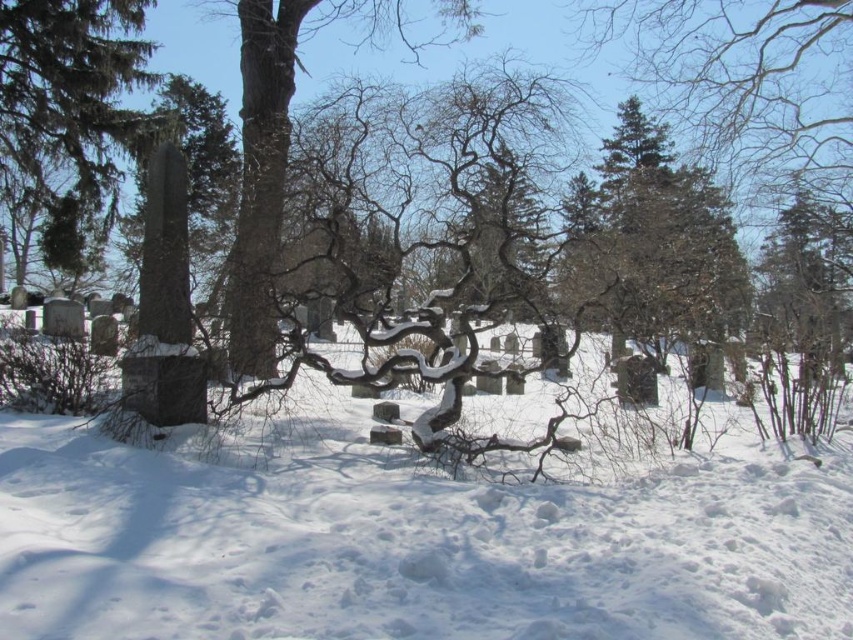
Question: Which of the following is the farthest from the observer?

Choices:
 (A) white powdery snow at center
 (B) smooth gray stone at left
 (C) smooth gray stone at center

Answer: (B)

Question: Is smooth gray stone at left closer to camera compared to smooth gray stone at center?

Choices:
 (A) no
 (B) yes

Answer: (A)

Question: Among these points, which one is nearest to the camera?

Choices:
 (A) (55, 90)
 (B) (579, 454)

Answer: (B)

Question: Which point appears closest to the camera in this image?

Choices:
 (A) (86, 115)
 (B) (271, 596)

Answer: (B)

Question: Can you confirm if white powdery snow at center is positioned below smooth gray stone at center?

Choices:
 (A) yes
 (B) no

Answer: (A)

Question: Is smooth gray stone at left closer to the viewer compared to smooth gray stone at center?

Choices:
 (A) no
 (B) yes

Answer: (A)